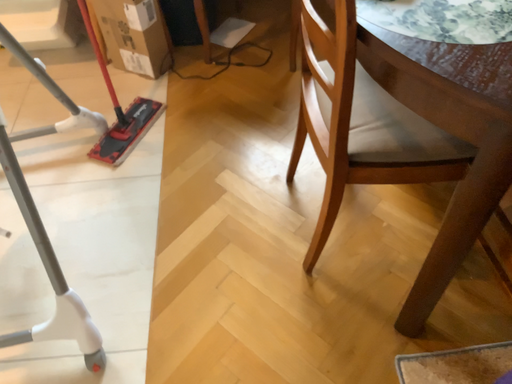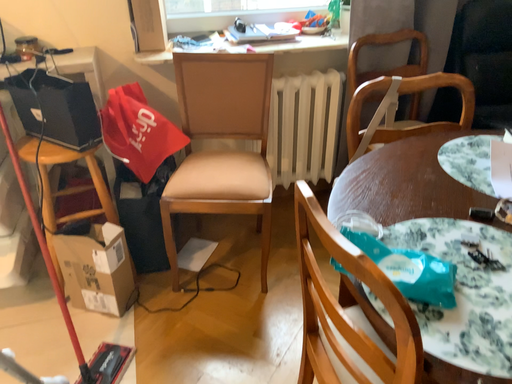
Question: Which way did the camera rotate in the video?

Choices:
 (A) rotated right
 (B) rotated left

Answer: (A)